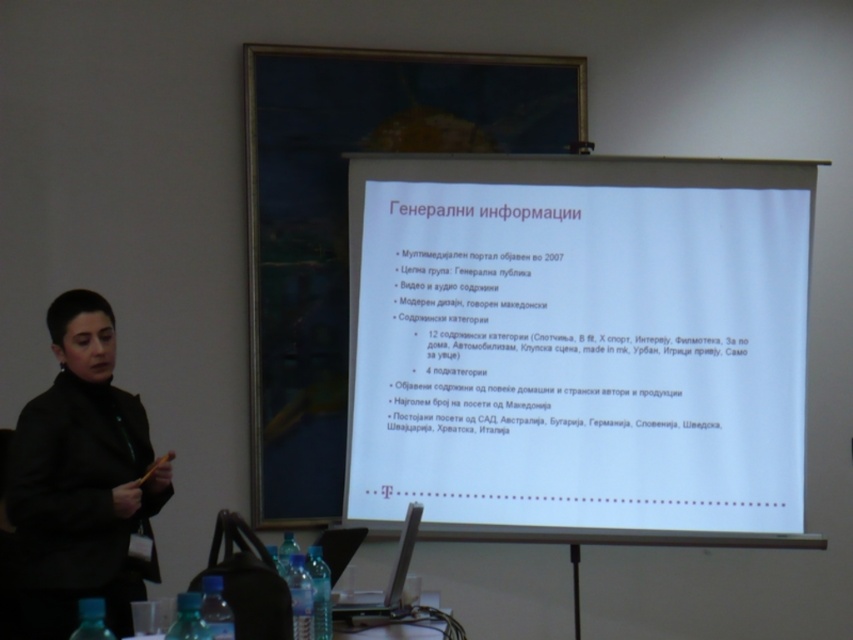
You are an attendee at this presentation and need to reference the white paper at center and the black matte jacket at left. Which object is located higher in the image?

The white paper at center is above the black matte jacket at left, so it is located higher in the image.

You are an attendee at the presentation. You notice two points marked on the projection screen. The first point is at coordinates point (566, 456) and the second is at point (152, 488). From your perspective, which point is closer to the bottom of the screen?

Point (152, 488) is closer to the bottom of the screen because its y coordinate is lower than point (566, 456).

You are organizing a presentation and need to place a new A4 size handout on the table. The white paper at center and the black matte jacket at left are already on the table. Can the new handout fit between them without overlapping?

The white paper at center is larger in size than the black matte jacket at left. Since an A4 handout is standard size, it might not fit between them if the space between the two objects is smaller than A4 dimensions. However, the exact positioning and spacing between the white paper at center and black matte jacket at left isn